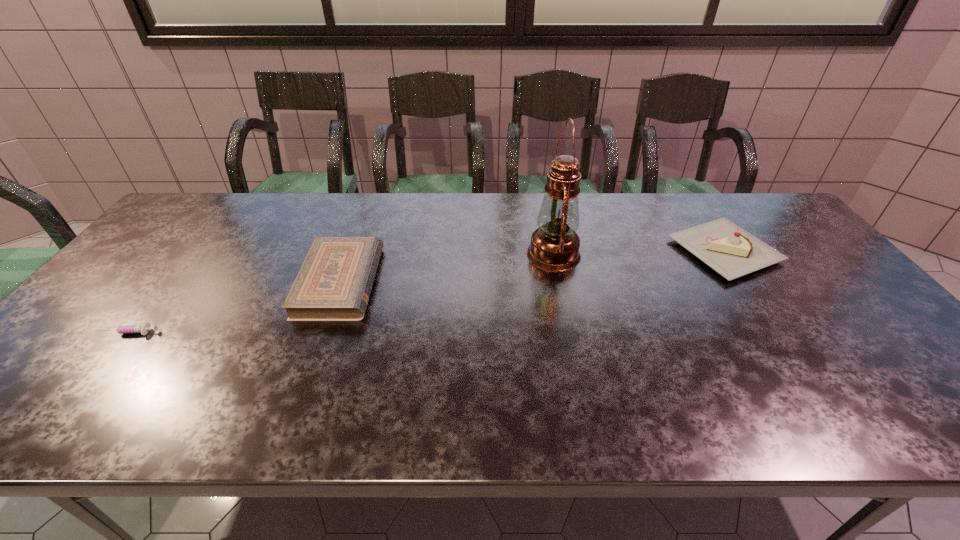
Image resolution: width=960 pixels, height=540 pixels. I want to click on the third object from left to right, so click(554, 246).

Where is `the tallest object`? This screenshot has width=960, height=540. the tallest object is located at coordinates (554, 246).

What are the coordinates of `cake` in the screenshot? It's located at (731, 251).

In order to click on the second tallest object in this screenshot , I will do `click(731, 251)`.

Find the location of `the second shortest object`. the second shortest object is located at coordinates (334, 283).

Locate an element on the screen. The height and width of the screenshot is (540, 960). the third object from right to left is located at coordinates (334, 283).

This screenshot has width=960, height=540. What are the coordinates of `syringe` in the screenshot? It's located at (128, 329).

This screenshot has width=960, height=540. I want to click on the shortest object, so click(x=128, y=329).

Image resolution: width=960 pixels, height=540 pixels. What are the coordinates of `free space located on the left of the oil lamp` in the screenshot? It's located at tap(503, 254).

Find the location of a particular element. This screenshot has height=540, width=960. vacant position located on the left of the third shortest object is located at coordinates (583, 251).